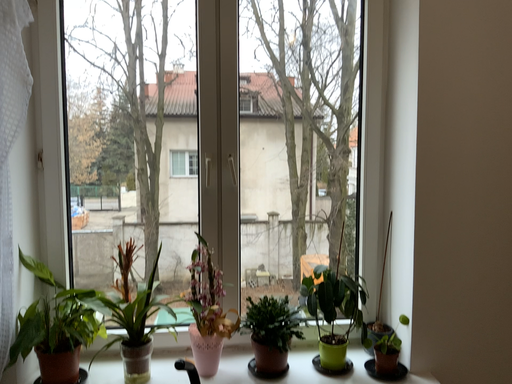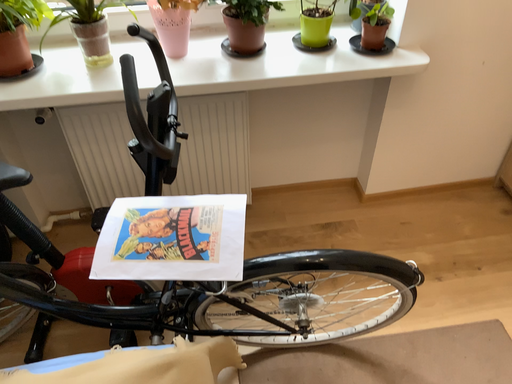
Question: Which way did the camera rotate in the video?

Choices:
 (A) rotated downward
 (B) rotated upward

Answer: (A)